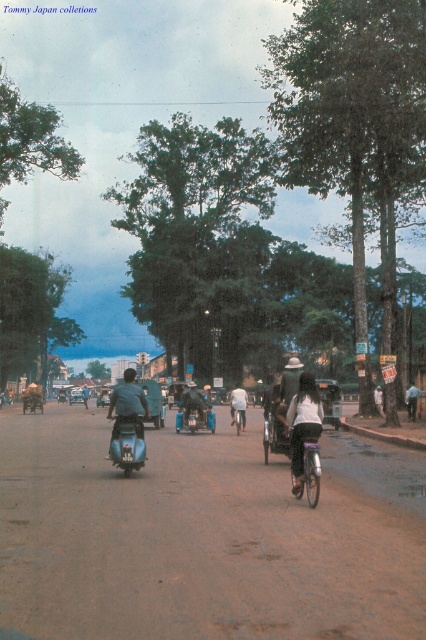
Question: Which object is closer to the camera taking this photo?

Choices:
 (A) white matte bicycle at center
 (B) blue metallic motorcycle at center
 (C) dark blue leather jacket at center

Answer: (A)

Question: Does blue metallic motorcycle at center appear under dark brown leather motorcycle at center?

Choices:
 (A) yes
 (B) no

Answer: (B)

Question: Is brown dirt track at center behind white matte person at center?

Choices:
 (A) yes
 (B) no

Answer: (B)

Question: Estimate the real-world distances between objects in this image. Which object is closer to the blue metallic motorcycle at center?

Choices:
 (A) dark blue leather jacket at center
 (B) white matte bicycle at center
 (C) light blue fabric shirt at center
 (D) white matte person at center

Answer: (A)

Question: Which object is positioned closest to the light blue fabric shirt at center?

Choices:
 (A) white matte bicycle at center
 (B) blue metallic motorcycle at center
 (C) white matte person at center

Answer: (C)

Question: Does metallic silver bicycle at center appear over light blue fabric shirt at center?

Choices:
 (A) yes
 (B) no

Answer: (A)